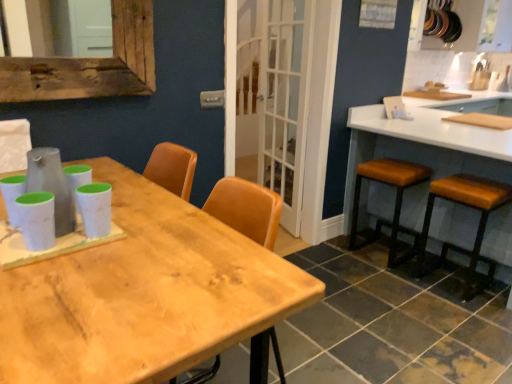
Find the location of a particular element. The width and height of the screenshot is (512, 384). free point in front of brown leather stool at right, which is counted as the 1th stool, starting from the left is located at coordinates (386, 282).